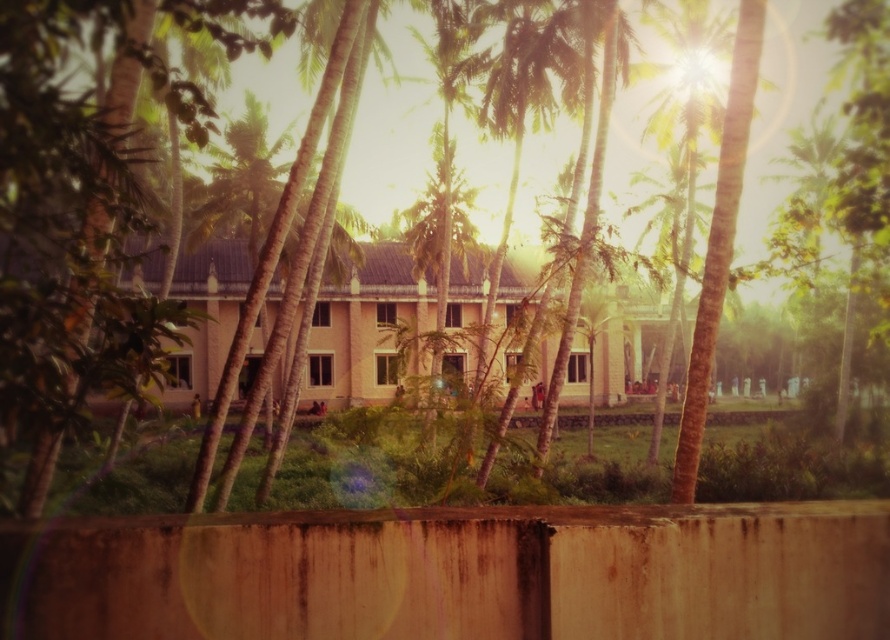
Question: Is rusty concrete fence at lower center smaller than green leafy palm tree at center?

Choices:
 (A) no
 (B) yes

Answer: (B)

Question: Does rusty concrete fence at lower center appear on the right side of green leafy palm tree at center?

Choices:
 (A) yes
 (B) no

Answer: (A)

Question: Which point is farther to the camera?

Choices:
 (A) (439, 372)
 (B) (290, 588)

Answer: (A)

Question: Can you confirm if rusty concrete fence at lower center is positioned above green leafy palm tree at center?

Choices:
 (A) no
 (B) yes

Answer: (A)

Question: Which object appears closest to the camera in this image?

Choices:
 (A) green leafy palm tree at center
 (B) rusty concrete fence at lower center

Answer: (B)